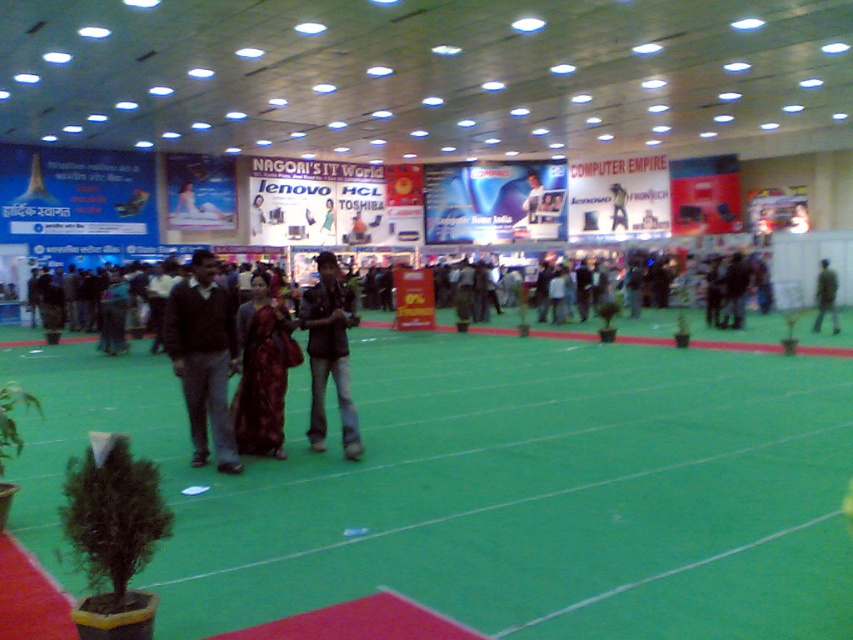
Question: Does dark brown sweater at center lie behind dark green fabric jacket at center?

Choices:
 (A) no
 (B) yes

Answer: (A)

Question: Can you confirm if dark brown sweater at center is smaller than denim jacket at center?

Choices:
 (A) no
 (B) yes

Answer: (B)

Question: Does dark brown sweater at center appear under denim jacket at center?

Choices:
 (A) yes
 (B) no

Answer: (A)

Question: Which object is the farthest from the dark brown sweater at center?

Choices:
 (A) maroon silk saree at center
 (B) green artificial turf at center

Answer: (B)

Question: Based on their relative distances, which object is farther from the dark brown sweater at center?

Choices:
 (A) denim jacket at center
 (B) dark green fabric jacket at center
 (C) green artificial turf at center
 (D) maroon silk saree at center

Answer: (B)

Question: Estimate the real-world distances between objects in this image. Which object is closer to the maroon silk saree at center?

Choices:
 (A) green artificial turf at center
 (B) dark green fabric jacket at center

Answer: (A)